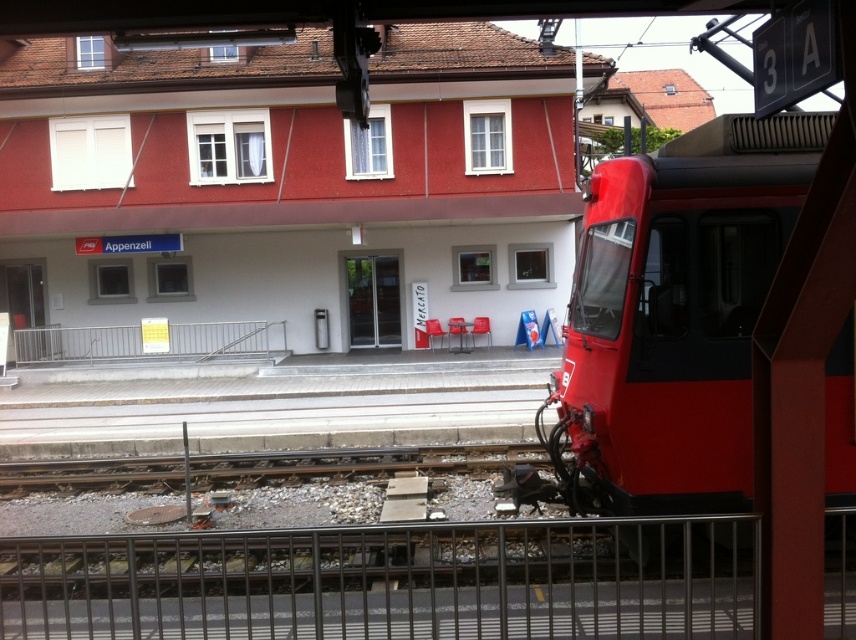
Describe the element at coordinates (675, 314) in the screenshot. I see `matte red train at right` at that location.

Which is more to the left, matte red train at right or metallic gray rail at center?

metallic gray rail at center

At what (x,y) coordinates should I click in order to perform the action: click on matte red train at right. Please return your answer as a coordinate pair (x, y). Image resolution: width=856 pixels, height=640 pixels. Looking at the image, I should click on click(x=675, y=314).

Can you confirm if metal at lower center is wider than metallic gray rail at center?

Yes.

Image resolution: width=856 pixels, height=640 pixels. I want to click on metal at lower center, so click(x=393, y=580).

Is metal at lower center to the left of matte red train at right from the viewer's perspective?

Correct, you'll find metal at lower center to the left of matte red train at right.

Which is behind, point (513, 560) or point (550, 454)?

Point (550, 454)

Between point (337, 580) and point (633, 244), which one is positioned in front?

Positioned in front is point (633, 244).

I want to click on metal at lower center, so click(x=393, y=580).